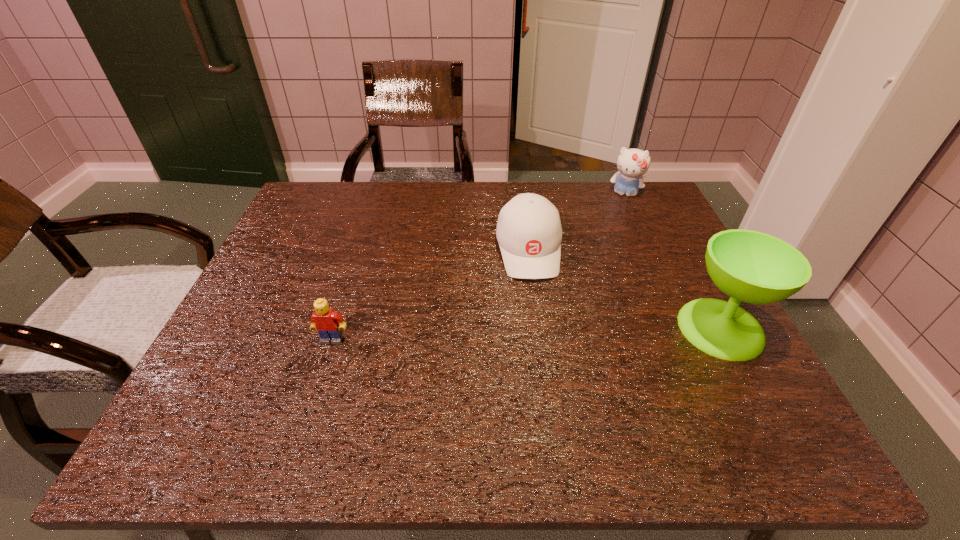
This screenshot has height=540, width=960. What are the coordinates of `vacant space that's between the farthest object and the Lego` in the screenshot? It's located at (478, 267).

Where is `vacant space that is in between the farthest object and the leftmost object`? vacant space that is in between the farthest object and the leftmost object is located at coordinates (478, 267).

Locate an element on the screen. Image resolution: width=960 pixels, height=540 pixels. free point between the baseball cap and the kitten is located at coordinates (576, 222).

Where is `vacant space that's between the tallest object and the second farthest object`? The image size is (960, 540). vacant space that's between the tallest object and the second farthest object is located at coordinates (625, 289).

Image resolution: width=960 pixels, height=540 pixels. In order to click on object identified as the third closest to the wineglass in this screenshot , I will do 325,321.

This screenshot has width=960, height=540. What are the coordinates of `the second closest object to the farthest object` in the screenshot? It's located at (753, 267).

You are a GUI agent. You are given a task and a screenshot of the screen. Output one action in this format:
    pyautogui.click(x=<x>, y=<y>)
    Task: Click on the free space that satisfies the following two spatial constraints: 1. on the front side of the farthest object; 2. on the left side of the tallest object
    This screenshot has width=960, height=540.
    Given the screenshot: What is the action you would take?
    pyautogui.click(x=685, y=328)

Where is `vacant space that satisfies the following two spatial constraints: 1. on the front side of the kitten; 2. on the right side of the wineglass`? vacant space that satisfies the following two spatial constraints: 1. on the front side of the kitten; 2. on the right side of the wineglass is located at coordinates (685, 328).